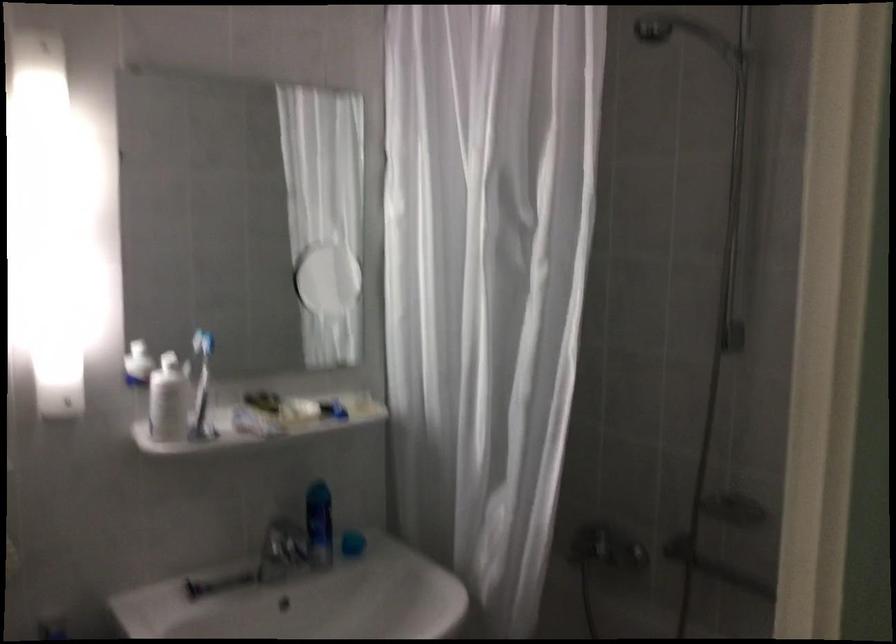
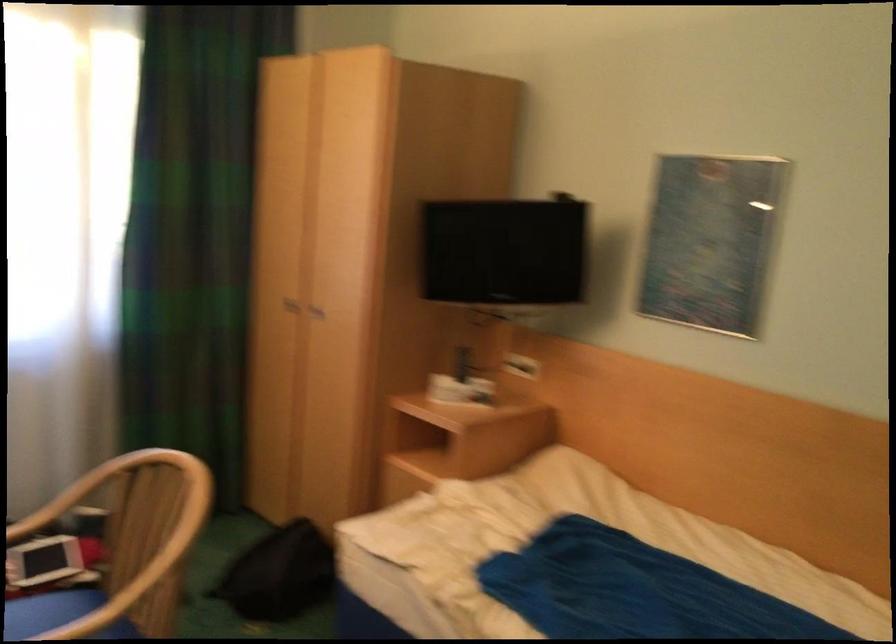
Question: Based on the continuous images, in which direction is the camera rotating? Reply with the corresponding letter.

Choices:
 (A) Left
 (B) Right
 (C) Up
 (D) Down

Answer: (A)